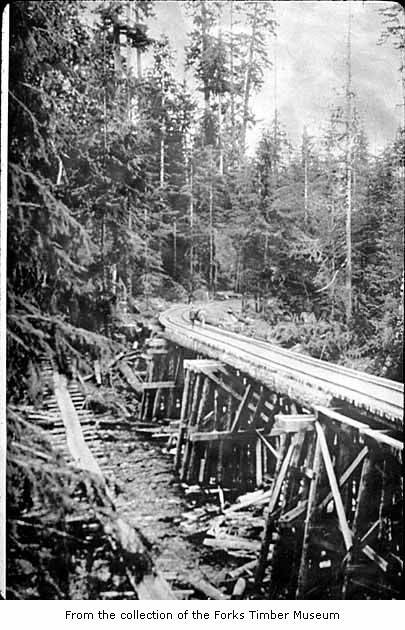
This screenshot has width=405, height=630. In order to click on white space under photo in this screenshot , I will do `click(377, 610)`.